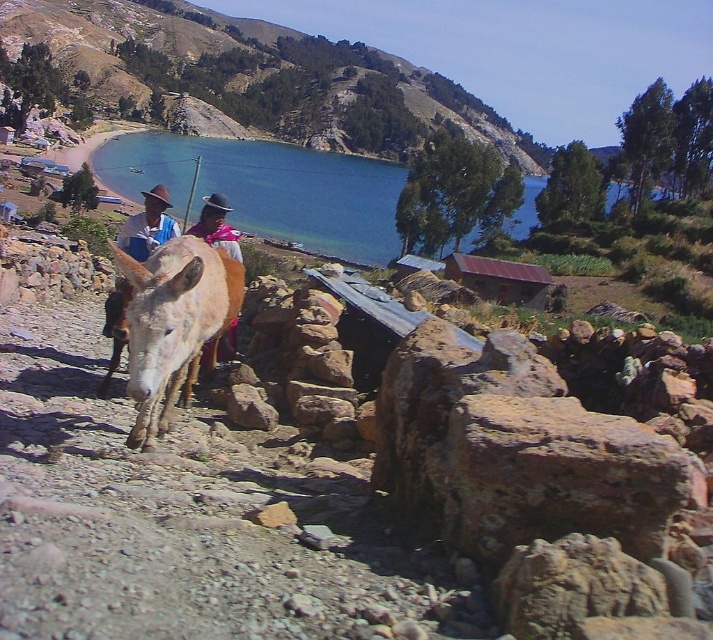
Question: Considering the relative positions of green grassy hillside at upper center and blue water at center in the image provided, where is green grassy hillside at upper center located with respect to blue water at center?

Choices:
 (A) left
 (B) right

Answer: (A)

Question: Which point appears closest to the camera in this image?

Choices:
 (A) (138, 276)
 (B) (205, 70)
 (C) (374, 161)

Answer: (A)

Question: Is green grassy hillside at upper center further to the viewer compared to light brown fur donkey at center?

Choices:
 (A) yes
 (B) no

Answer: (A)

Question: Which object is farther from the camera taking this photo?

Choices:
 (A) light brown fur donkey at center
 (B) blue water at center
 (C) green grassy hillside at upper center

Answer: (C)

Question: Can you confirm if green grassy hillside at upper center is positioned to the right of blue water at center?

Choices:
 (A) yes
 (B) no

Answer: (B)

Question: Which point is farther to the camera?

Choices:
 (A) light brown fur donkey at center
 (B) blue water at center

Answer: (B)